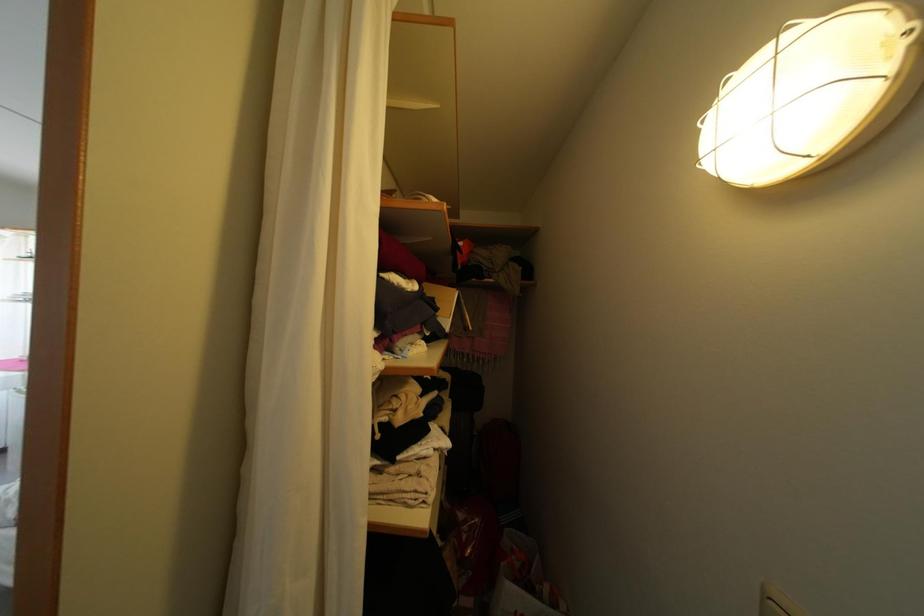
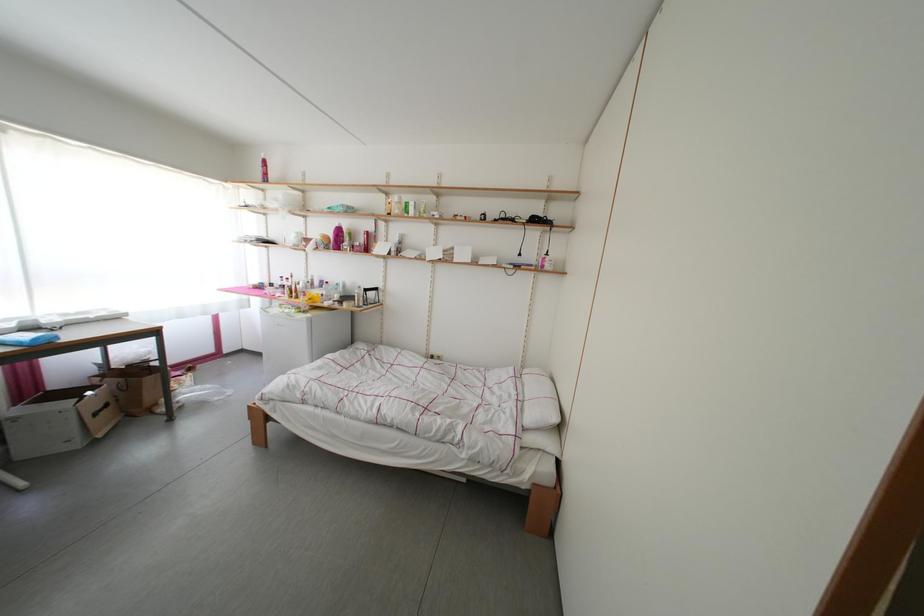
Question: How did the camera likely rotate?

Choices:
 (A) Left
 (B) Right
 (C) Up
 (D) Down

Answer: (A)